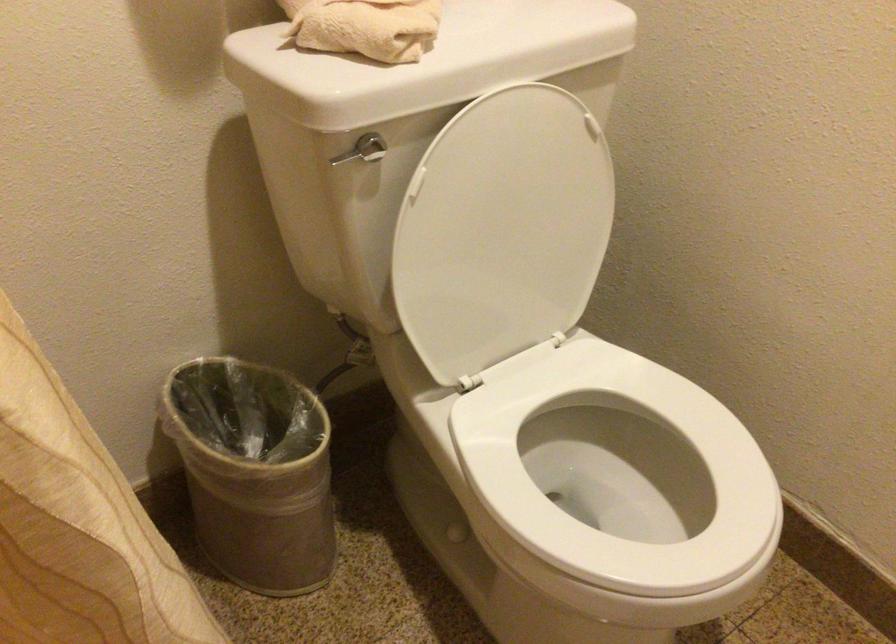
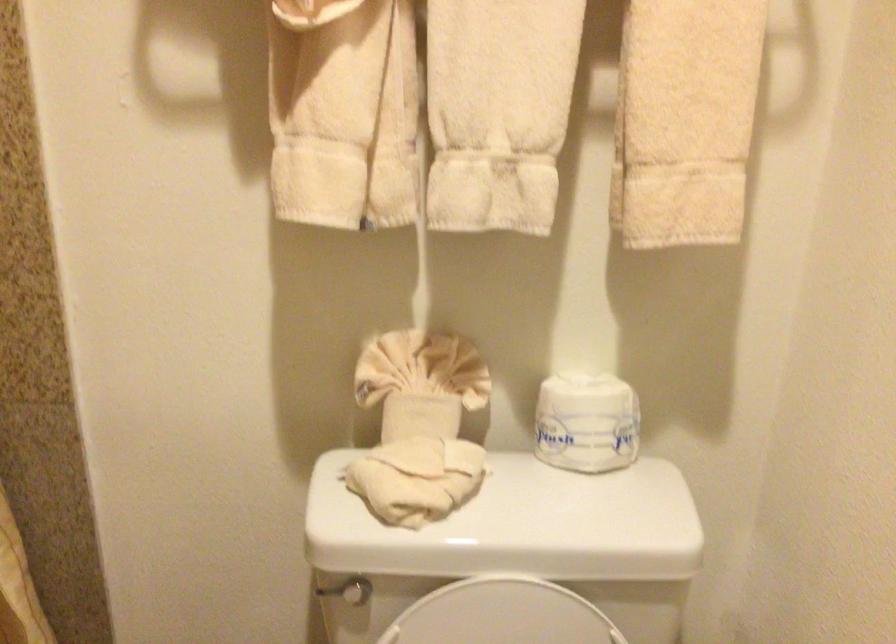
In the second image, find the point that corresponds to pixel 332 158 in the first image.

(326, 590)